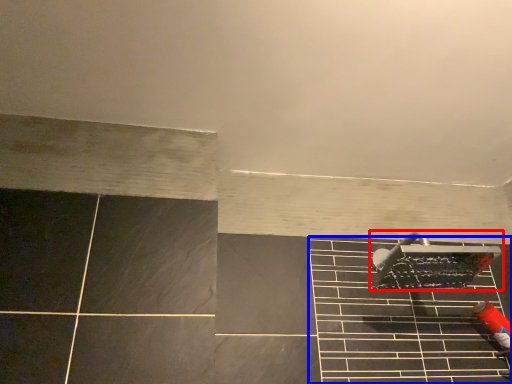
Question: Which object appears closest to the camera in this image, shower (highlighted by a red box) or ceramic tile (highlighted by a blue box)?

Choices:
 (A) shower
 (B) ceramic tile

Answer: (B)